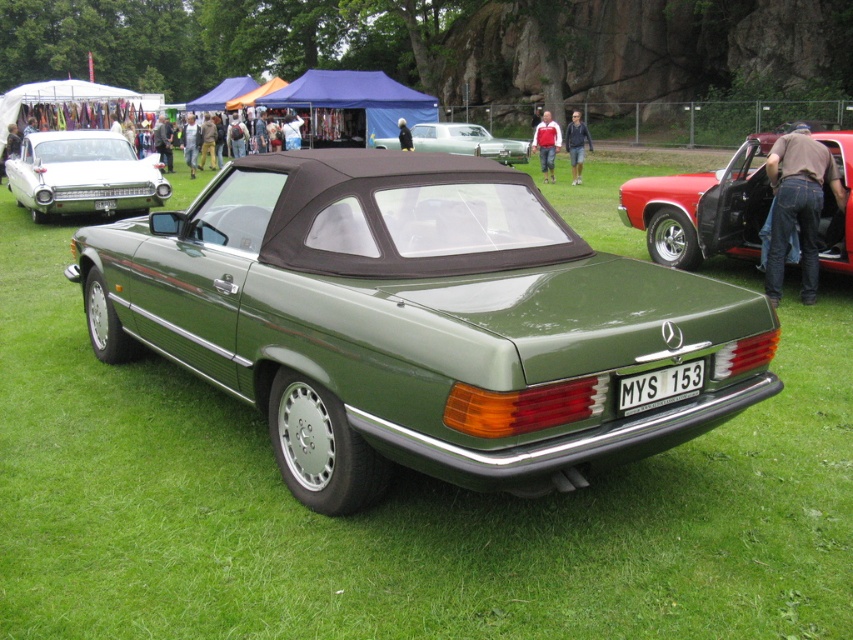
You are a photographer trying to capture the metallic silver car at center and the white plastic license plate at center in the same frame. Since you want to ensure both are fully visible, which object should you zoom in on to make sure they are both in the frame?

The metallic silver car at center is narrower than the white plastic license plate at center, so you should zoom in on the metallic silver car at center to ensure both are visible in the frame.

You are a photographer standing at the edge of the grassy field where the green glossy convertible at center is parked. You want to take a photo of the car without any other vehicles in the frame. Given that the nearest vehicle is 3.03 meters away from the convertible, is this possible?

The nearest vehicle is 3.03 meters away from the green glossy convertible at center. Since this distance is sufficient to avoid other vehicles in the frame, it is possible to take a photo of the green glossy convertible at center without any other vehicles in the frame.

You are standing at the origin point of the coordinate system. The green glossy convertible at center is located at point 0.503, 0.489. If you want to walk directly to the car, which direction should you move in?

The green glossy convertible at center is located at point (x=416, y=321), so you should move towards the center of the field to reach it.